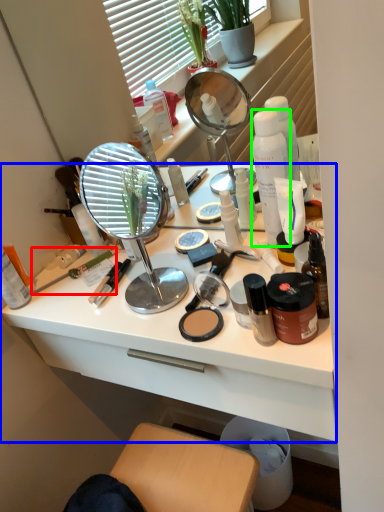
Question: Which is nearer to the brush (highlighted by a red box)? desk (highlighted by a blue box) or product (highlighted by a green box).

Choices:
 (A) desk
 (B) product

Answer: (A)